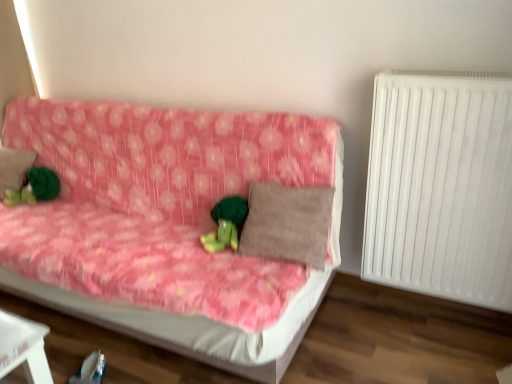
What do you see at coordinates (167, 225) in the screenshot? This screenshot has height=384, width=512. I see `pink floral fabric couch at center` at bounding box center [167, 225].

The height and width of the screenshot is (384, 512). In order to click on brown textured pillow at center, acting as the 1th pillow starting from the front in this screenshot , I will do `click(287, 223)`.

Describe the element at coordinates (287, 223) in the screenshot. The image size is (512, 384). I see `brown textured pillow at center, marked as the 1th pillow in a right-to-left arrangement` at that location.

What do you see at coordinates (14, 168) in the screenshot? I see `brown fabric pillow at left, arranged as the first pillow when viewed from the back` at bounding box center [14, 168].

Image resolution: width=512 pixels, height=384 pixels. What do you see at coordinates (35, 188) in the screenshot?
I see `green plush toy at left, which appears as the 1th toy when viewed from the back` at bounding box center [35, 188].

Identify the location of green plush toy at left, the first toy from the left. (35, 188).

Find the location of a particular element. This screenshot has width=512, height=384. green plush toy at center, which is the first toy from front to back is located at coordinates (226, 224).

In the scene shown: Considering the sizes of objects green plush toy at center, the 2th toy from the back, and green plush toy at left, the first toy from the left, in the image provided, who is shorter, green plush toy at center, the 2th toy from the back, or green plush toy at left, the first toy from the left,?

green plush toy at center, the 2th toy from the back.

You are a GUI agent. You are given a task and a screenshot of the screen. Output one action in this format:
    pyautogui.click(x=<x>, y=<y>)
    Task: Click on the toy beneath the green plush toy at center, the 2th toy from the back (from a real-world perspective)
    The width and height of the screenshot is (512, 384).
    Given the screenshot: What is the action you would take?
    pyautogui.click(x=35, y=188)

Is green plush toy at center, which is the first toy from front to back, wider than green plush toy at left, acting as the second toy starting from the right?

Yes, green plush toy at center, which is the first toy from front to back, is wider than green plush toy at left, acting as the second toy starting from the right.

Does green plush toy at center, which is the 1th toy from right to left, appear on the right side of green plush toy at left, the first toy from the left?

Correct, you'll find green plush toy at center, which is the 1th toy from right to left, to the right of green plush toy at left, the first toy from the left.

Which of these two, green plush toy at left, the second toy in the front-to-back sequence, or pink floral fabric couch at center, is thinner?

green plush toy at left, the second toy in the front-to-back sequence, is thinner.

Considering the relative sizes of green plush toy at left, the first toy from the left, and pink floral fabric couch at center in the image provided, is green plush toy at left, the first toy from the left, taller than pink floral fabric couch at center?

No, green plush toy at left, the first toy from the left, is not taller than pink floral fabric couch at center.

Is green plush toy at left, acting as the second toy starting from the right, at the right side of pink floral fabric couch at center?

No, green plush toy at left, acting as the second toy starting from the right, is not to the right of pink floral fabric couch at center.

From a real-world perspective, is brown textured pillow at center, acting as the 2th pillow starting from the left, above or below white plastic radiator at right?

brown textured pillow at center, acting as the 2th pillow starting from the left, is situated lower than white plastic radiator at right in the real world.

Which of these two, brown textured pillow at center, acting as the 1th pillow starting from the front, or white plastic radiator at right, stands shorter?

brown textured pillow at center, acting as the 1th pillow starting from the front.

This screenshot has height=384, width=512. Find the location of `pillow below the white plastic radiator at right (from the image's perspective)`. pillow below the white plastic radiator at right (from the image's perspective) is located at coordinates (287, 223).

Does brown textured pillow at center, acting as the 2th pillow starting from the left, come behind white plastic radiator at right?

Yes, brown textured pillow at center, acting as the 2th pillow starting from the left, is further from the viewer.

Considering the sizes of objects white plastic radiator at right and brown fabric pillow at left, arranged as the second pillow when viewed from the front, in the image provided, who is shorter, white plastic radiator at right or brown fabric pillow at left, arranged as the second pillow when viewed from the front,?

With less height is brown fabric pillow at left, arranged as the second pillow when viewed from the front.

Based on their positions, is white plastic radiator at right located to the left or right of brown fabric pillow at left, the second pillow when ordered from right to left?

In the image, white plastic radiator at right appears on the right side of brown fabric pillow at left, the second pillow when ordered from right to left.

From the image's perspective, is white plastic radiator at right located above or below brown fabric pillow at left, the second pillow when ordered from right to left?

Based on their image positions, white plastic radiator at right is located beneath brown fabric pillow at left, the second pillow when ordered from right to left.

How different are the orientations of white plastic radiator at right and brown fabric pillow at left, arranged as the first pillow when viewed from the back, in degrees?

They differ by 0.487 degrees in their facing directions.

Does brown textured pillow at center, which is the 2th pillow in back-to-front order, turn towards pink floral fabric couch at center?

Yes, brown textured pillow at center, which is the 2th pillow in back-to-front order, faces towards pink floral fabric couch at center.

Considering the relative positions of brown textured pillow at center, marked as the 1th pillow in a right-to-left arrangement, and pink floral fabric couch at center in the image provided, is brown textured pillow at center, marked as the 1th pillow in a right-to-left arrangement, to the right of pink floral fabric couch at center from the viewer's perspective?

Yes.

Is point (297, 253) closer to viewer compared to point (110, 288)?

No, it is not.

Is brown textured pillow at center, acting as the 1th pillow starting from the front, closer to camera compared to pink floral fabric couch at center?

No.

Does pink floral fabric couch at center have a larger size compared to brown textured pillow at center, acting as the 1th pillow starting from the front?

Indeed, pink floral fabric couch at center has a larger size compared to brown textured pillow at center, acting as the 1th pillow starting from the front.

Locate an element on the screen. The height and width of the screenshot is (384, 512). studio couch that appears on the left of brown textured pillow at center, acting as the 1th pillow starting from the front is located at coordinates (167, 225).

From a real-world perspective, between pink floral fabric couch at center and brown textured pillow at center, marked as the 1th pillow in a right-to-left arrangement, who is vertically higher?

brown textured pillow at center, marked as the 1th pillow in a right-to-left arrangement, from a real-world perspective.

Would you say pink floral fabric couch at center is a long distance from brown textured pillow at center, marked as the 1th pillow in a right-to-left arrangement?

No, pink floral fabric couch at center is in close proximity to brown textured pillow at center, marked as the 1th pillow in a right-to-left arrangement.

Is pink floral fabric couch at center taller than white plastic radiator at right?

No, pink floral fabric couch at center is not taller than white plastic radiator at right.

Could you tell me if pink floral fabric couch at center is turned towards white plastic radiator at right?

No, pink floral fabric couch at center is not turned towards white plastic radiator at right.

Considering the positions of point (258, 343) and point (463, 223), is point (258, 343) closer or farther from the camera than point (463, 223)?

Point (258, 343).

This screenshot has height=384, width=512. In order to click on radiator behind the pink floral fabric couch at center in this screenshot , I will do `click(441, 187)`.

You are a GUI agent. You are given a task and a screenshot of the screen. Output one action in this format:
    pyautogui.click(x=<x>, y=<y>)
    Task: Click on the toy below the green plush toy at left, the first toy from the left (from the image's perspective)
    This screenshot has width=512, height=384.
    Given the screenshot: What is the action you would take?
    pyautogui.click(x=226, y=224)

At what (x,y) coordinates should I click in order to perform the action: click on toy on the left of the pink floral fabric couch at center. Please return your answer as a coordinate pair (x, y). Looking at the image, I should click on (35, 188).

Based on the photo, considering their positions, is pink floral fabric couch at center positioned closer to brown textured pillow at center, marked as the 1th pillow in a right-to-left arrangement, than brown fabric pillow at left, arranged as the second pillow when viewed from the front?

pink floral fabric couch at center lies closer to brown textured pillow at center, marked as the 1th pillow in a right-to-left arrangement, than the other object.

Consider the image. From the image, which object appears to be farther from brown textured pillow at center, acting as the 1th pillow starting from the front, green plush toy at left, the second toy in the front-to-back sequence, or white plastic radiator at right?

The object further to brown textured pillow at center, acting as the 1th pillow starting from the front, is green plush toy at left, the second toy in the front-to-back sequence.

Looking at the image, which one is located further to white plastic radiator at right, pink floral fabric couch at center or green plush toy at center, which is the first toy from front to back?

green plush toy at center, which is the first toy from front to back, is positioned further to the anchor white plastic radiator at right.

From the image, which object appears to be farther from brown textured pillow at center, acting as the 2th pillow starting from the left, brown fabric pillow at left, which is counted as the 1th pillow, starting from the left, or green plush toy at left, acting as the second toy starting from the right?

The object further to brown textured pillow at center, acting as the 2th pillow starting from the left, is brown fabric pillow at left, which is counted as the 1th pillow, starting from the left.

When comparing their distances from green plush toy at center, positioned as the 2th toy in left-to-right order, does brown fabric pillow at left, arranged as the second pillow when viewed from the front, or white plastic radiator at right seem closer?

Based on the image, white plastic radiator at right appears to be nearer to green plush toy at center, positioned as the 2th toy in left-to-right order.

From the image, which object appears to be farther from green plush toy at left, the first toy from the left, pink floral fabric couch at center or white plastic radiator at right?

The object further to green plush toy at left, the first toy from the left, is white plastic radiator at right.

When comparing their distances from green plush toy at center, positioned as the 2th toy in left-to-right order, does pink floral fabric couch at center or white plastic radiator at right seem closer?

pink floral fabric couch at center.

Estimate the real-world distances between objects in this image. Which object is closer to pink floral fabric couch at center, white plastic radiator at right or brown textured pillow at center, marked as the 1th pillow in a right-to-left arrangement?

The object closer to pink floral fabric couch at center is brown textured pillow at center, marked as the 1th pillow in a right-to-left arrangement.

This screenshot has width=512, height=384. I want to click on toy between green plush toy at left, acting as the second toy starting from the right, and brown textured pillow at center, marked as the 1th pillow in a right-to-left arrangement, in the horizontal direction, so click(x=226, y=224).

The height and width of the screenshot is (384, 512). Find the location of `studio couch situated between brown fabric pillow at left, arranged as the second pillow when viewed from the front, and brown textured pillow at center, marked as the 1th pillow in a right-to-left arrangement, from left to right`. studio couch situated between brown fabric pillow at left, arranged as the second pillow when viewed from the front, and brown textured pillow at center, marked as the 1th pillow in a right-to-left arrangement, from left to right is located at coordinates (167, 225).

Image resolution: width=512 pixels, height=384 pixels. I want to click on studio couch situated between brown fabric pillow at left, arranged as the second pillow when viewed from the front, and white plastic radiator at right from left to right, so click(x=167, y=225).

Image resolution: width=512 pixels, height=384 pixels. Find the location of `pillow between pink floral fabric couch at center and white plastic radiator at right in the horizontal direction`. pillow between pink floral fabric couch at center and white plastic radiator at right in the horizontal direction is located at coordinates (287, 223).